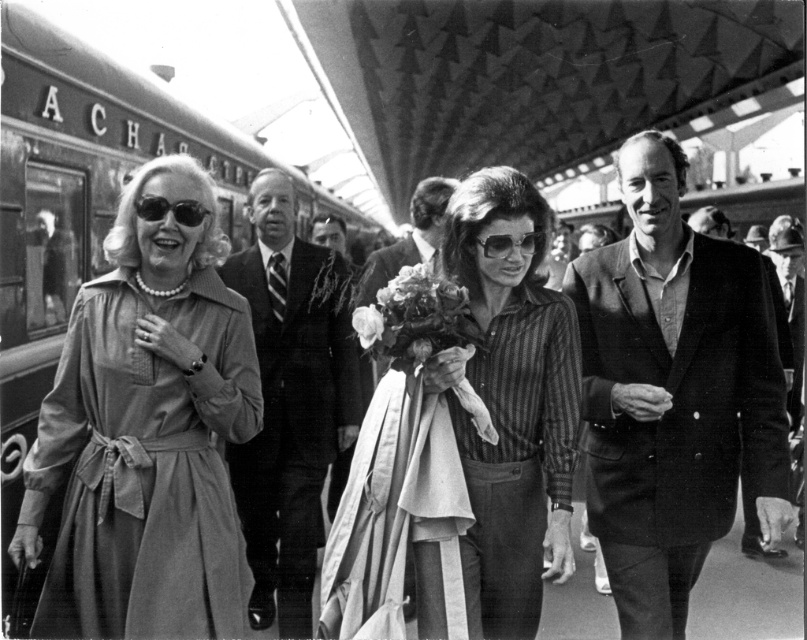
Is matte beige dress at left in front of striped fabric shirt at center?

Yes, matte beige dress at left is closer to the viewer.

Between matte beige dress at left and striped fabric shirt at center, which one has less height?

Standing shorter between the two is matte beige dress at left.

At what (x,y) coordinates should I click in order to perform the action: click on matte beige dress at left. Please return your answer as a coordinate pair (x, y). The height and width of the screenshot is (640, 807). Looking at the image, I should click on (145, 435).

Which of these two, smooth black suit at center or soft white petals at center, stands taller?

smooth black suit at center

Who is lower down, smooth black suit at center or soft white petals at center?

Positioned lower is smooth black suit at center.

This screenshot has height=640, width=807. I want to click on smooth black suit at center, so click(x=291, y=401).

Where is `smooth black suit at center`? smooth black suit at center is located at coordinates pos(291,401).

Is point (40, 628) positioned behind point (412, 301)?

No.

Can you confirm if matte beige dress at left is positioned below soft white petals at center?

Yes.

This screenshot has width=807, height=640. What are the coordinates of `matte beige dress at left` in the screenshot? It's located at (145, 435).